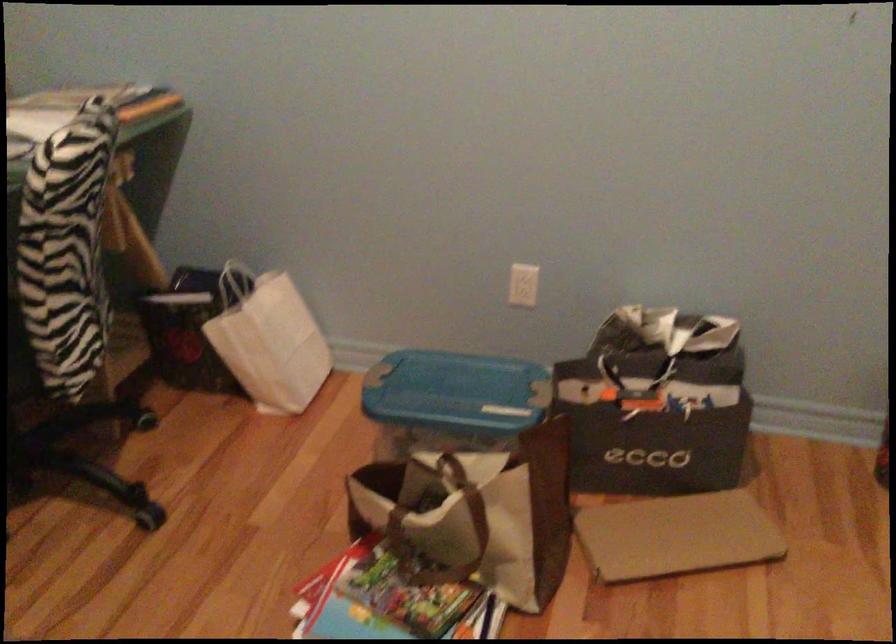
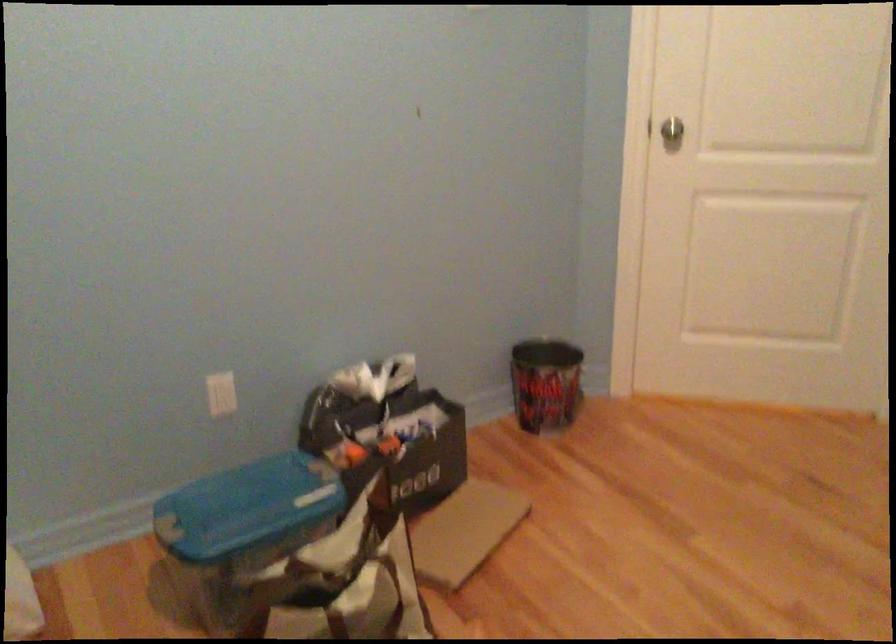
The point at (x=523, y=281) is marked in the first image. Where is the corresponding point in the second image?

(220, 393)